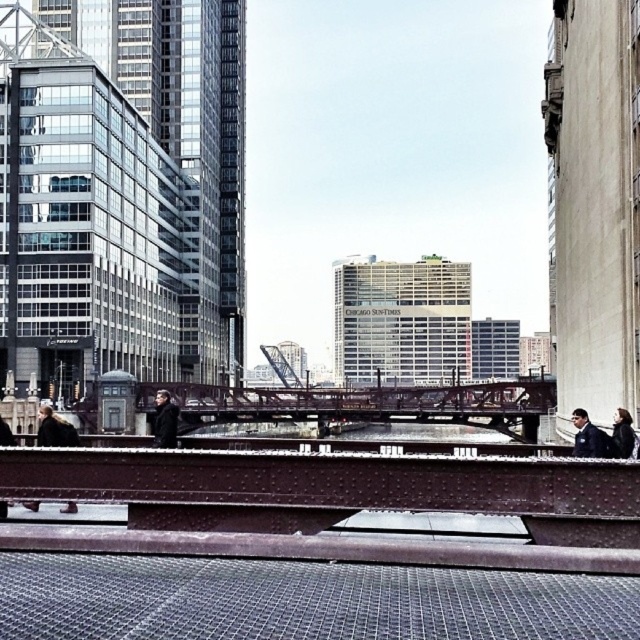
Question: Does dark brown leather jacket at center appear on the left side of dark blue jacket at right?

Choices:
 (A) yes
 (B) no

Answer: (A)

Question: Which of the following is the closest to the observer?

Choices:
 (A) (596, 438)
 (B) (624, 436)
 (C) (113, 522)

Answer: (C)

Question: Is metallic steel bench at lower left thinner than black matte jacket at right?

Choices:
 (A) yes
 (B) no

Answer: (B)

Question: Does metallic steel bench at lower left appear on the right side of black matte jacket at right?

Choices:
 (A) yes
 (B) no

Answer: (B)

Question: Which object is the closest to the dark brown leather jacket at center?

Choices:
 (A) metallic steel bench at lower left
 (B) black leather coat at center
 (C) black matte jacket at right

Answer: (A)

Question: Which of these objects is positioned farthest from the dark brown leather jacket at center?

Choices:
 (A) metallic steel bench at lower left
 (B) dark blue jacket at right

Answer: (B)